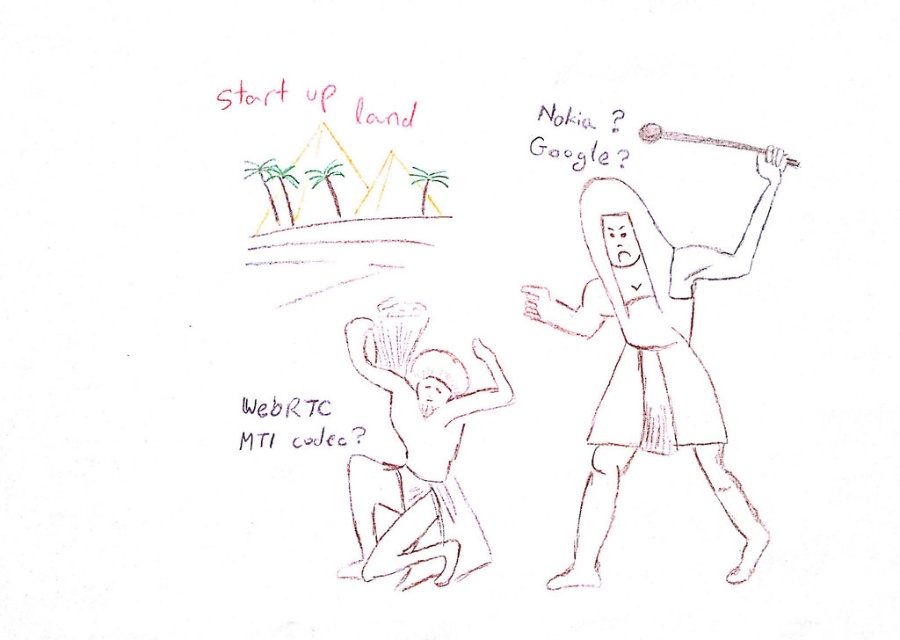
Which is above, smooth paper figure at right or smooth skin figure at lower left?

smooth paper figure at right is above.

Is point (666, 243) positioned before point (367, 552)?

No, it is not.

Identify the location of smooth paper figure at right. (651, 358).